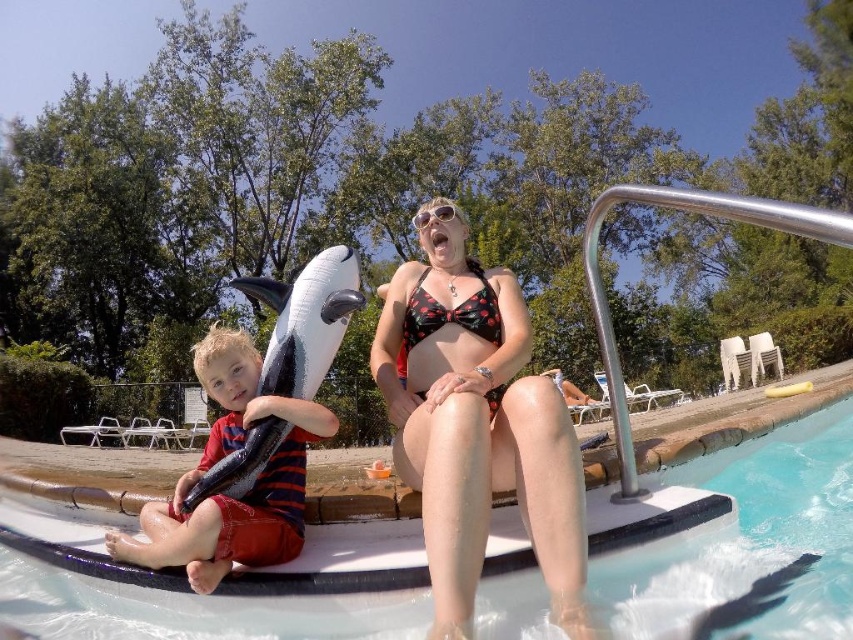
Question: Considering the real-world distances, which object is farthest from the striped cotton shirt at left?

Choices:
 (A) white glossy water at lower center
 (B) black floral bikini at upper center

Answer: (A)

Question: Is white glossy water at lower center above striped cotton shirt at left?

Choices:
 (A) no
 (B) yes

Answer: (A)

Question: Does white glossy water at lower center appear over striped cotton shirt at left?

Choices:
 (A) yes
 (B) no

Answer: (B)

Question: Among these points, which one is farthest from the camera?

Choices:
 (A) (633, 570)
 (B) (229, 346)

Answer: (B)

Question: Which point is closer to the camera?

Choices:
 (A) (372, 365)
 (B) (202, 362)

Answer: (B)

Question: Is white glossy water at lower center below black floral bikini at upper center?

Choices:
 (A) yes
 (B) no

Answer: (A)